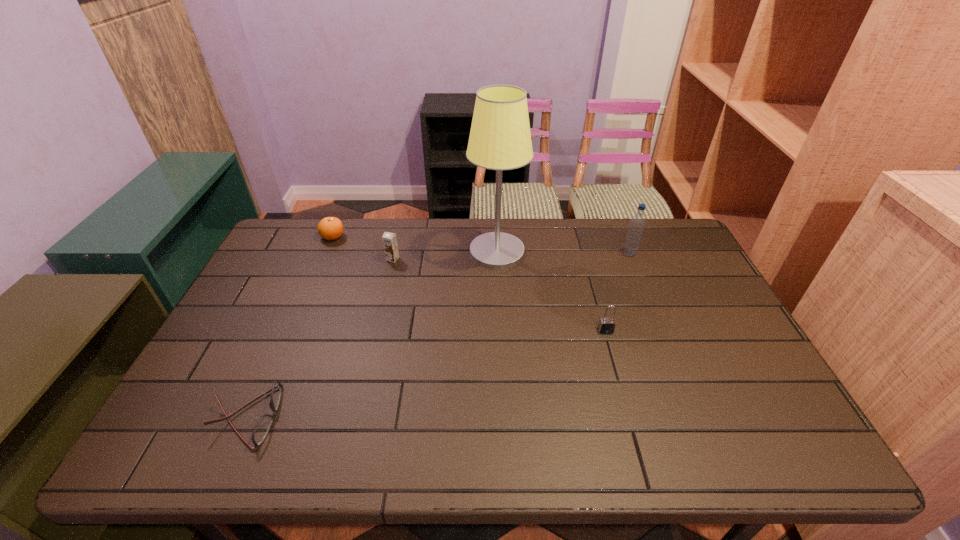
The width and height of the screenshot is (960, 540). What are the coordinates of `vacant space situated 0.240m on the right of the third object from right to left` in the screenshot? It's located at (597, 252).

The width and height of the screenshot is (960, 540). Identify the location of vacant space situated 0.050m on the front of the fifth shortest object. (636, 267).

Where is `vacant space situated 0.350m on the front of the third object from left to right`? This screenshot has width=960, height=540. vacant space situated 0.350m on the front of the third object from left to right is located at coordinates (372, 346).

Locate an element on the screen. The image size is (960, 540). free space located 0.270m on the shackle of the fifth object from left to right is located at coordinates (632, 423).

At what (x,y) coordinates should I click in order to perform the action: click on vacant region located 0.220m on the front of the second shortest object. Please return your answer as a coordinate pair (x, y). This screenshot has width=960, height=540. Looking at the image, I should click on (311, 287).

Locate an element on the screen. The height and width of the screenshot is (540, 960). vacant space located 0.270m on the front-facing side of the spectacles is located at coordinates (395, 417).

Find the location of a particular element. table lamp present at the far edge is located at coordinates (500, 139).

The image size is (960, 540). I want to click on water bottle that is at the far edge, so click(636, 227).

This screenshot has height=540, width=960. Identify the location of chocolate milk located at the far edge. (389, 239).

Identify the location of clementine positioned at the far edge. The width and height of the screenshot is (960, 540). (329, 228).